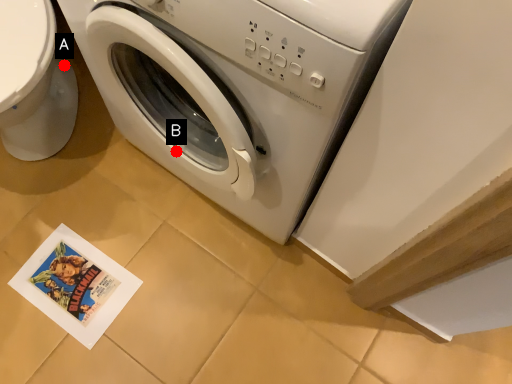
Question: Two points are circled on the image, labeled by A and B beside each circle. Which point is closer to the camera taking this photo?

Choices:
 (A) A is closer
 (B) B is closer

Answer: (B)